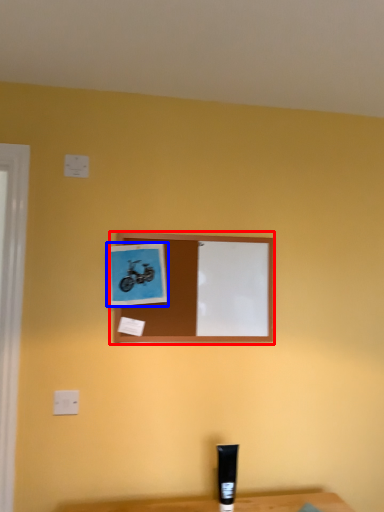
Question: Among these objects, which one is nearest to the camera, picture frame (highlighted by a red box) or picture frame (highlighted by a blue box)?

Choices:
 (A) picture frame
 (B) picture frame

Answer: (B)